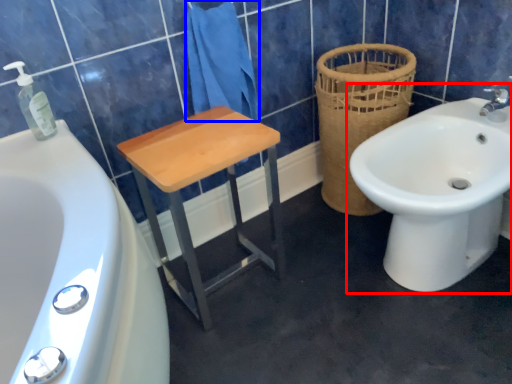
Question: Which object appears farthest to the camera in this image, sink (highlighted by a red box) or bath towel (highlighted by a blue box)?

Choices:
 (A) sink
 (B) bath towel

Answer: (B)